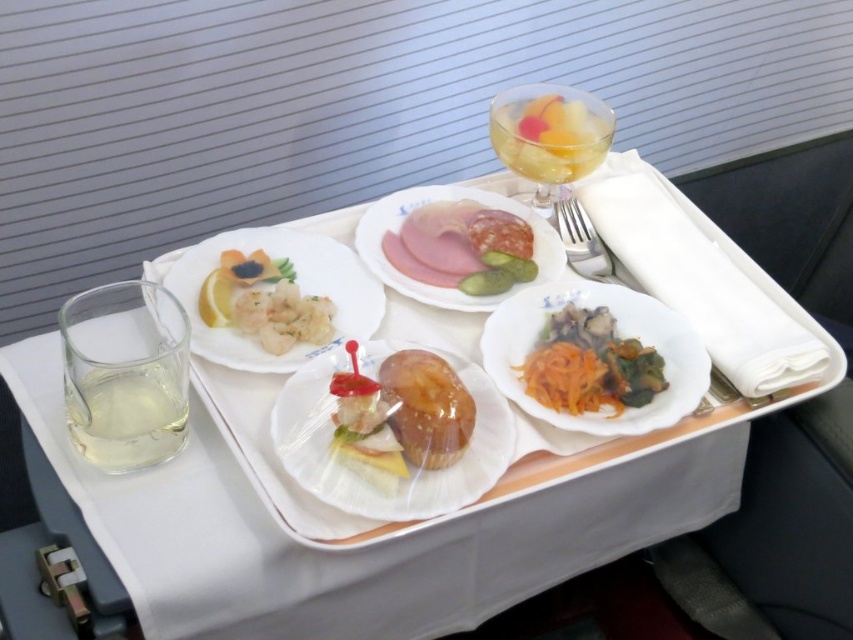
Question: Is translucent plastic plate at center positioned behind white glossy plate at upper center?

Choices:
 (A) no
 (B) yes

Answer: (A)

Question: Which of the following is the farthest from the observer?

Choices:
 (A) (432, 506)
 (B) (619, 381)
 (C) (163, 420)
 (D) (277, 296)

Answer: (D)

Question: Which is farther from the sliced ham and salami at center?

Choices:
 (A) shiny orange shredded carrots at center
 (B) white glossy shrimp at upper left

Answer: (B)

Question: Considering the real-world distances, which object is farthest from the sliced ham and salami at center?

Choices:
 (A) white glossy shrimp at upper left
 (B) shiny orange shredded carrots at center
 (C) translucent plastic sandwich at center

Answer: (C)

Question: Is white glossy plate at upper center smaller than shiny orange shredded carrots at center?

Choices:
 (A) yes
 (B) no

Answer: (B)

Question: Considering the relative positions of translucent glass wine glass at upper right and sliced ham and salami at center in the image provided, where is translucent glass wine glass at upper right located with respect to sliced ham and salami at center?

Choices:
 (A) right
 (B) left

Answer: (A)